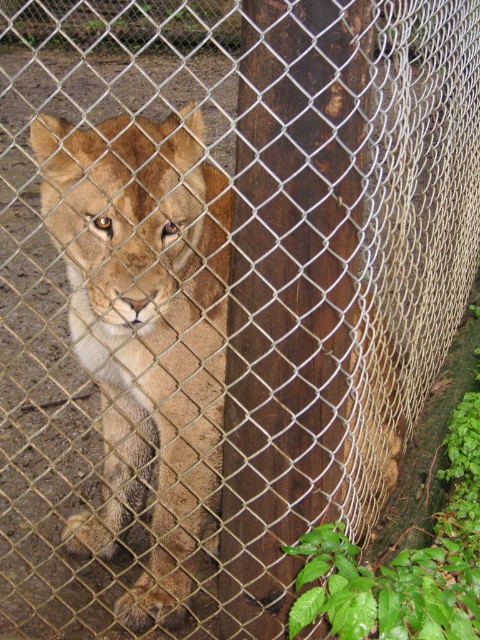
Does brown wood pole at center appear under golden fur lion at center?

Incorrect, brown wood pole at center is not positioned below golden fur lion at center.

Find the location of a particular element. brown wood pole at center is located at coordinates (289, 294).

I want to click on brown wood pole at center, so click(289, 294).

Locate an element on the screen. This screenshot has height=640, width=480. brown wood pole at center is located at coordinates (289, 294).